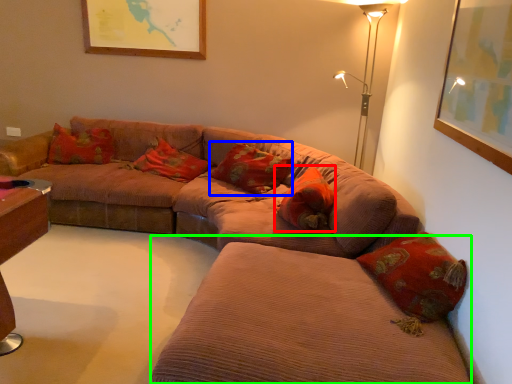
Question: Considering the real-world distances, which object is farthest from pillow (highlighted by a red box)? pillow (highlighted by a blue box) or couch (highlighted by a green box)?

Choices:
 (A) pillow
 (B) couch

Answer: (B)